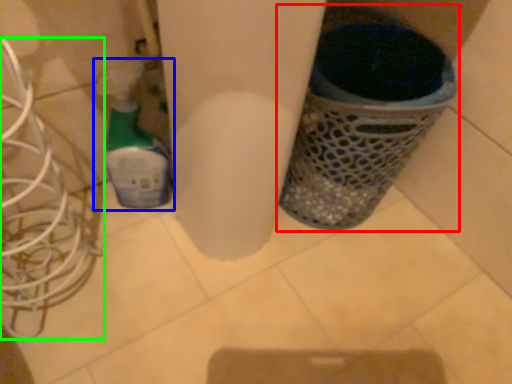
Question: Based on their relative distances, which object is nearer to waste container (highlighted by a red box)? Choose from bottle (highlighted by a blue box) and wire (highlighted by a green box).

Choices:
 (A) bottle
 (B) wire

Answer: (A)